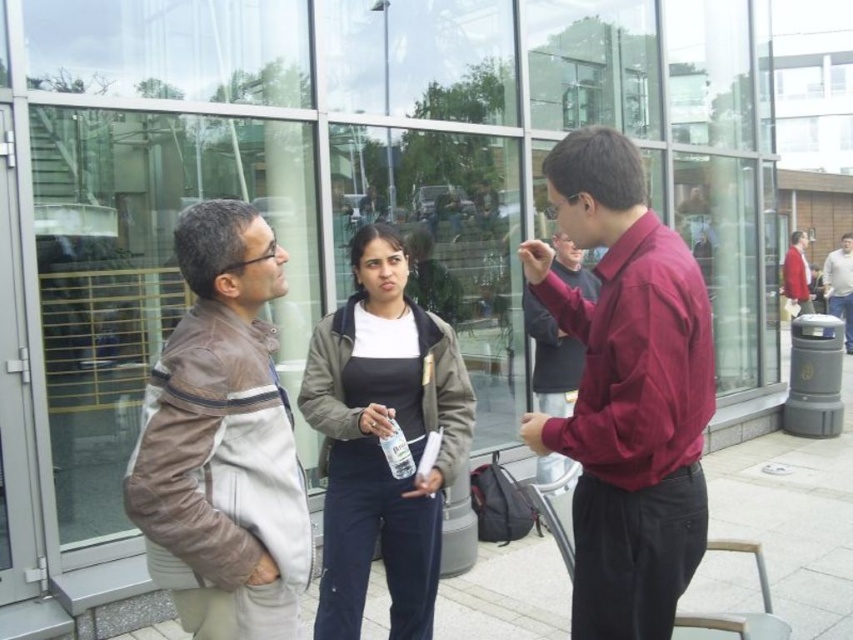
You are an observer looking at the scene outside the modern building. You notice two people wearing the matte maroon shirt at center and the dark green jacket at center. Which one is positioned higher in the image?

The matte maroon shirt at center is located above the dark green jacket at center, so the matte maroon shirt at center is positioned higher in the image.

You are a photographer trying to capture a group photo of the dark green jacket at center and the dark gray sweater at center. Based on their positions, which one might require more space in the frame to avoid being cut off?

The dark green jacket at center might require more space in the frame since it might be wider than the dark gray sweater at center.